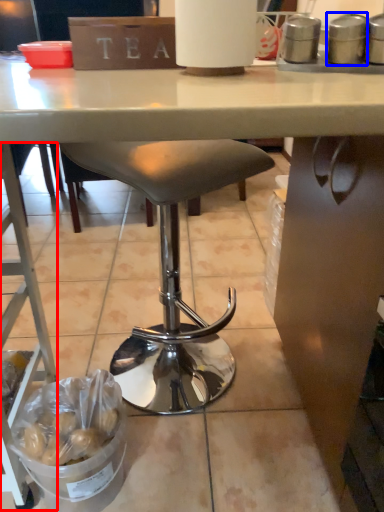
Question: Which point is further to the camera, ladder (highlighted by a red box) or appliance (highlighted by a blue box)?

Choices:
 (A) ladder
 (B) appliance

Answer: (B)